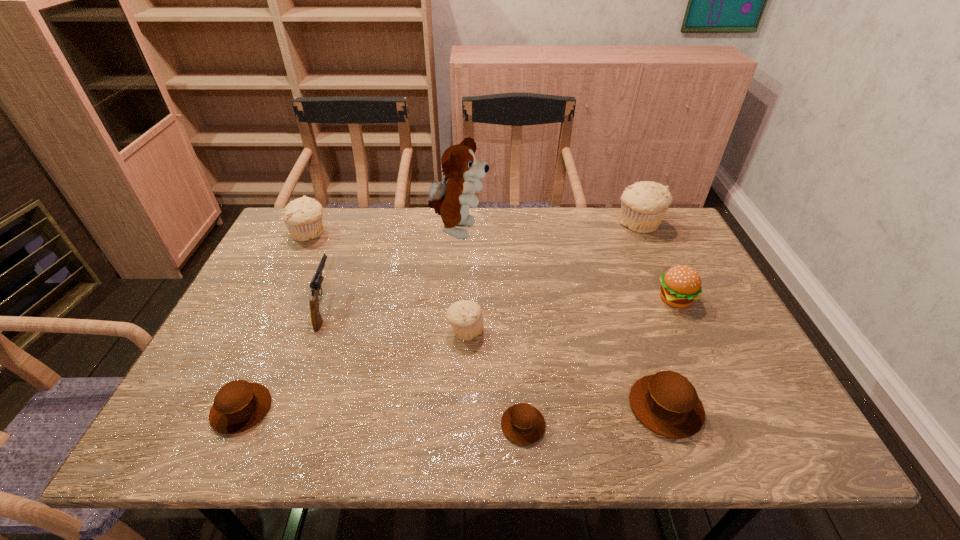
Where is `free space between the hamburger and the second tallest object`? The width and height of the screenshot is (960, 540). free space between the hamburger and the second tallest object is located at coordinates (657, 262).

This screenshot has height=540, width=960. Identify the location of vacant space that's between the brown puppy and the black gun. (392, 269).

Find the location of a particular element. The image size is (960, 540). empty location between the fourth muffin from right to left and the fifth tallest muffin is located at coordinates (353, 370).

The width and height of the screenshot is (960, 540). What are the coordinates of `vacant region between the biggest brown muffin and the second tallest muffin` in the screenshot? It's located at (488, 320).

Identify the location of vacant area between the second smallest beige muffin and the fourth nearest muffin. (387, 282).

Locate an element on the screen. unoccupied area between the biggest beige muffin and the third muffin from right to left is located at coordinates (581, 325).

At what (x,y) coordinates should I click in order to perform the action: click on unoccupied position between the tallest muffin and the fourth object from right to left. Please return your answer as a coordinate pair (x, y). This screenshot has height=540, width=960. Looking at the image, I should click on (581, 325).

I want to click on vacant area that lies between the hamburger and the second brown muffin from left to right, so click(x=599, y=362).

Image resolution: width=960 pixels, height=540 pixels. Find the location of `unoccupied area between the leftmost beige muffin and the brown puppy`. unoccupied area between the leftmost beige muffin and the brown puppy is located at coordinates (384, 233).

Locate which object ranks third in proximity to the nearest beige muffin. Please provide its 2D coordinates. Your answer should be formatted as a tuple, i.e. [(x, y)], where the tuple contains the x and y coordinates of a point satisfying the conditions above.

[(315, 285)]